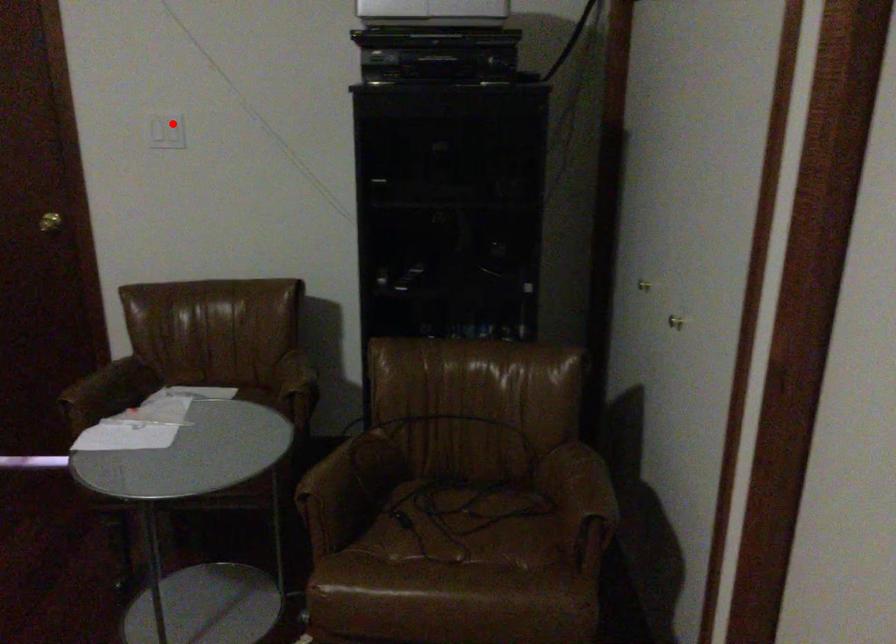
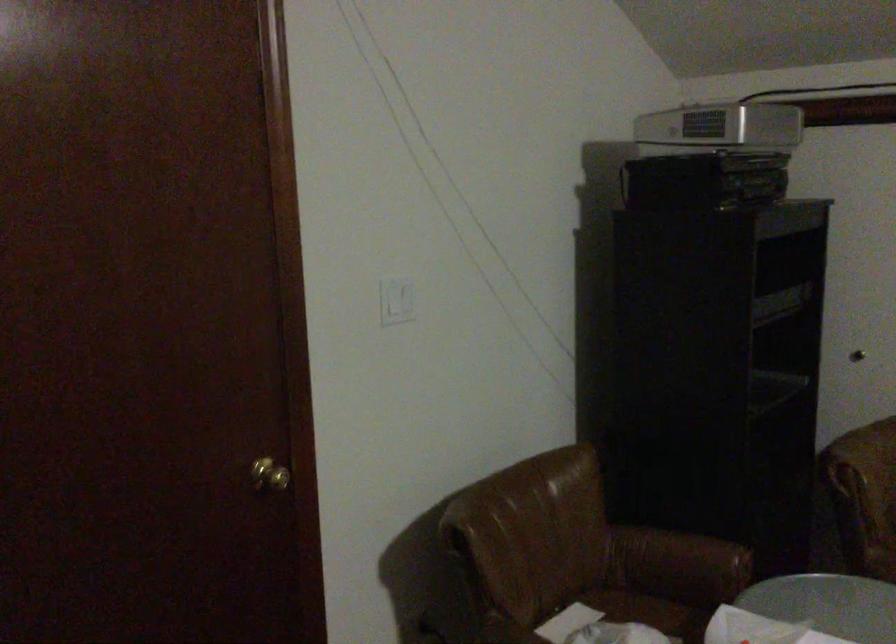
Question: A red point is marked in image1. In image2, is the corresponding 3D point closer to the camera or farther? Reply with the corresponding letter.

Choices:
 (A) The corresponding 3D point is closer.
 (B) The corresponding 3D point is farther.

Answer: (A)